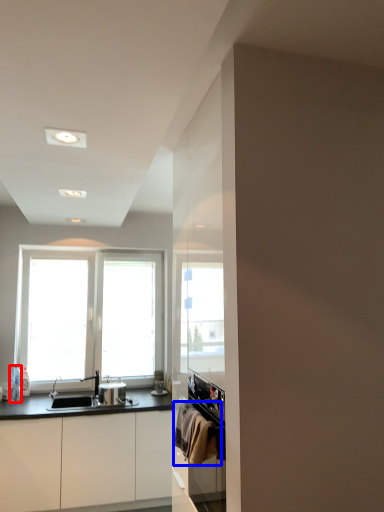
Question: Which object appears farthest to the camera in this image, bottle (highlighted by a red box) or laundry (highlighted by a blue box)?

Choices:
 (A) bottle
 (B) laundry

Answer: (A)